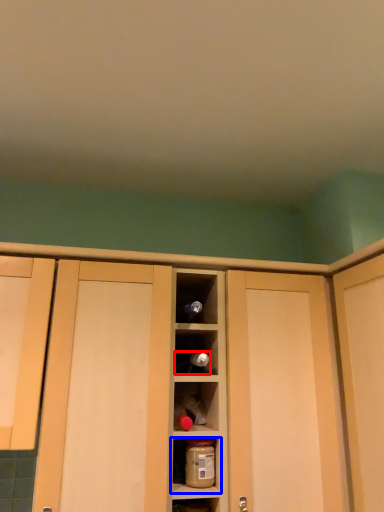
Question: Among these objects, which one is nearest to the camera, wine bottle (highlighted by a red box) or shelf (highlighted by a blue box)?

Choices:
 (A) wine bottle
 (B) shelf

Answer: (B)